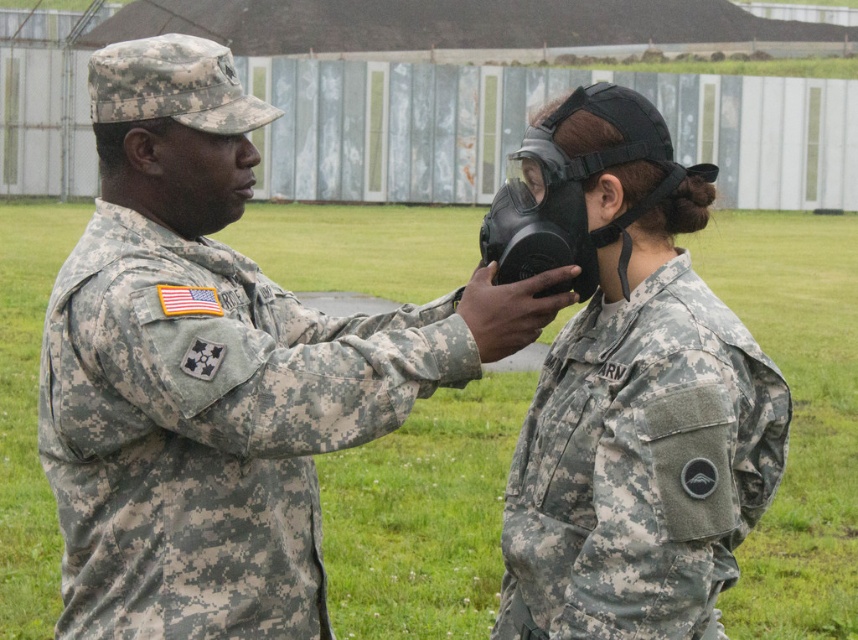
Question: Does matte black gas mask at center appear on the right side of matte black mask at center?

Choices:
 (A) no
 (B) yes

Answer: (B)

Question: Does camouflage uniform at left have a lesser width compared to matte black gas mask at center?

Choices:
 (A) yes
 (B) no

Answer: (B)

Question: Can you confirm if camouflage uniform at left is positioned to the right of matte black gas mask at center?

Choices:
 (A) no
 (B) yes

Answer: (A)

Question: Which point is farther from the camera taking this photo?

Choices:
 (A) (112, 218)
 (B) (647, 138)
 (C) (490, 339)

Answer: (A)

Question: Which point is farther to the camera?

Choices:
 (A) (492, 316)
 (B) (166, 416)
 (C) (579, 196)

Answer: (C)

Question: Which point is farther to the camera?

Choices:
 (A) camouflage uniform at left
 (B) matte black gas mask at center

Answer: (A)